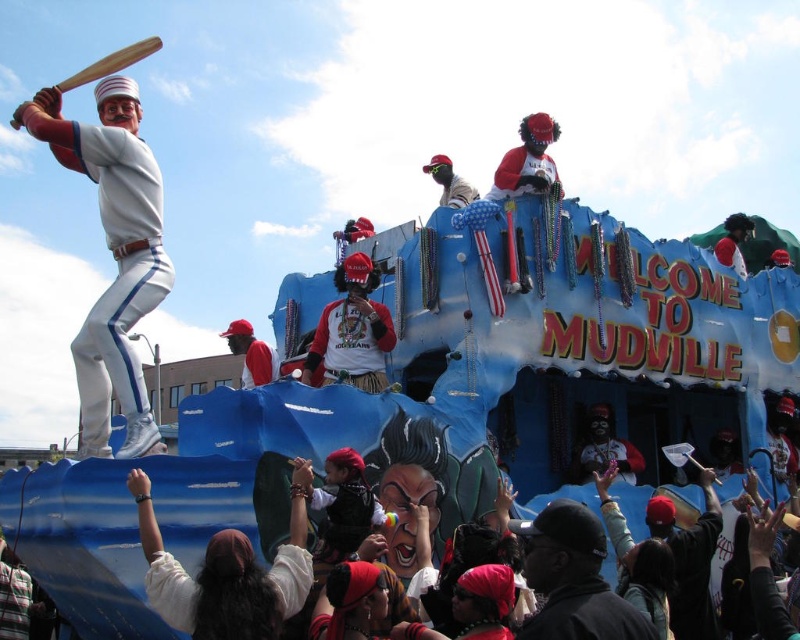
Is black matte baseball cap at lower center positioned before reddish-brown leather jacket at center?

Yes.

Is black matte baseball cap at lower center positioned at the back of reddish-brown leather jacket at center?

No.

Identify the location of black matte baseball cap at lower center. The image size is (800, 640). (574, 579).

Locate an element on the screen. black matte baseball cap at lower center is located at coordinates (574, 579).

The height and width of the screenshot is (640, 800). I want to click on reddish-brown leather jacket at center, so click(x=352, y=330).

Is point (356, 284) closer to viewer compared to point (268, 364)?

Yes, it is.

Is point (346, 364) closer to viewer compared to point (252, 387)?

Yes, point (346, 364) is closer to viewer.

Locate an element on the screen. The height and width of the screenshot is (640, 800). reddish-brown leather jacket at center is located at coordinates pyautogui.click(x=352, y=330).

From the picture: Can you confirm if white matte baseball bat at left is positioned to the left of matte red cap at center?

Correct, you'll find white matte baseball bat at left to the left of matte red cap at center.

The width and height of the screenshot is (800, 640). Identify the location of white matte baseball bat at left. (112, 253).

Between point (138, 296) and point (238, 333), which one is positioned in front?

Point (138, 296)

The height and width of the screenshot is (640, 800). In order to click on white matte baseball bat at left in this screenshot , I will do `click(112, 253)`.